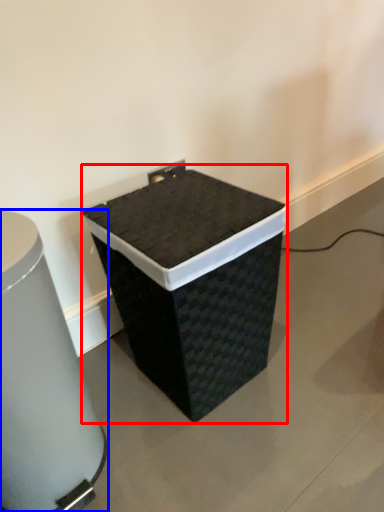
Question: Which point is closer to the camera, waste container (highlighted by a red box) or waste container (highlighted by a blue box)?

Choices:
 (A) waste container
 (B) waste container

Answer: (B)